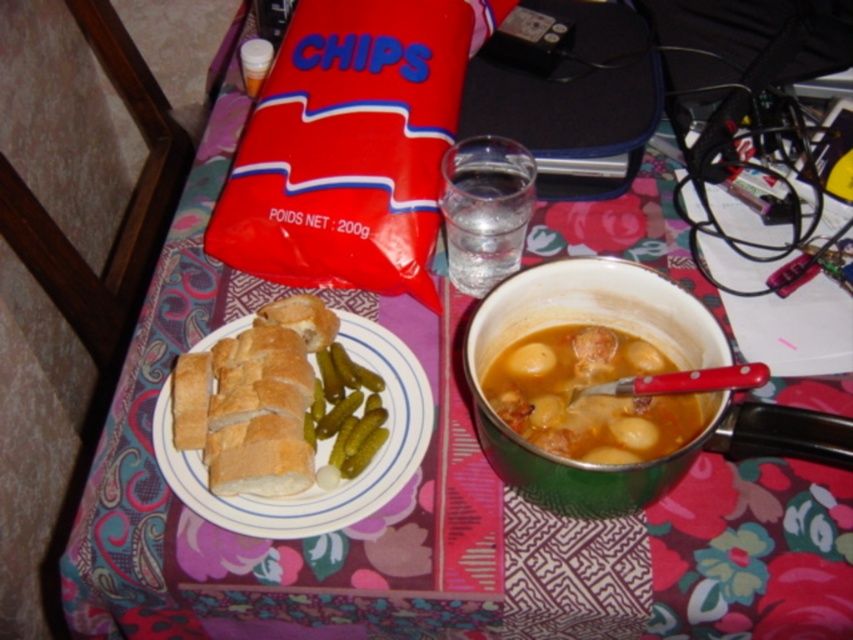
You are a guest at a dinner party and want to reach for the brown matte stew at center without disturbing the green enamel bowl at center. Can you do this easily?

The green enamel bowl at center is closer to the viewer than the brown matte stew at center, so you would need to move the green enamel bowl at center first to access the brown matte stew at center without disturbing it.

You are a person with a 16 inch long arm. You want to reach the green enamel bowl at center on the table. Can you reach it?

The green enamel bowl at center is 17.74 inches away from viewer. Since your arm is 16 inches long, you cannot reach it.

You are a guest at this table and want to reach for the clear glass water at center without knocking over the white ceramic plate at center. Based on their positions, which object should you move first?

The white ceramic plate at center is below the clear glass water at center, so you should move the white ceramic plate at center first to avoid knocking it over when reaching for the glass.